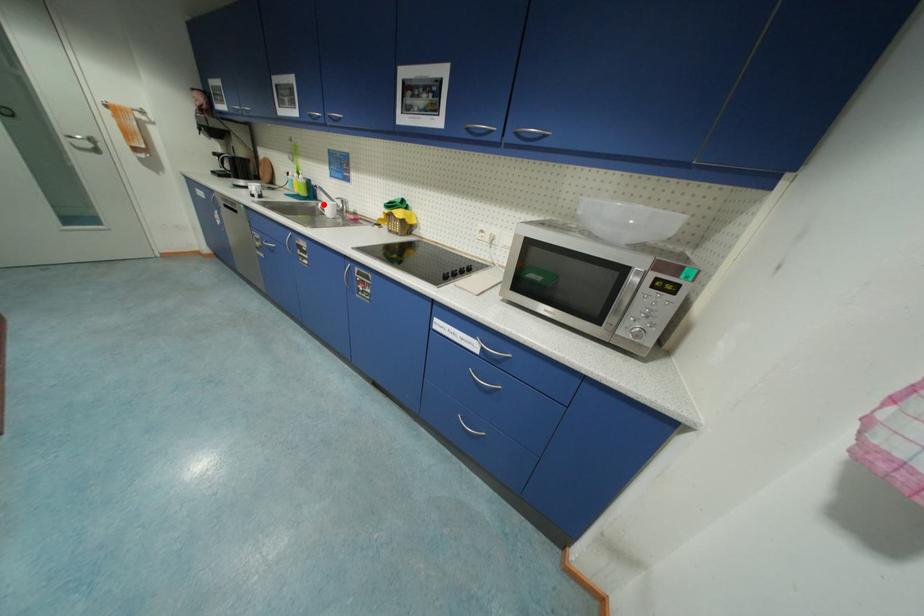
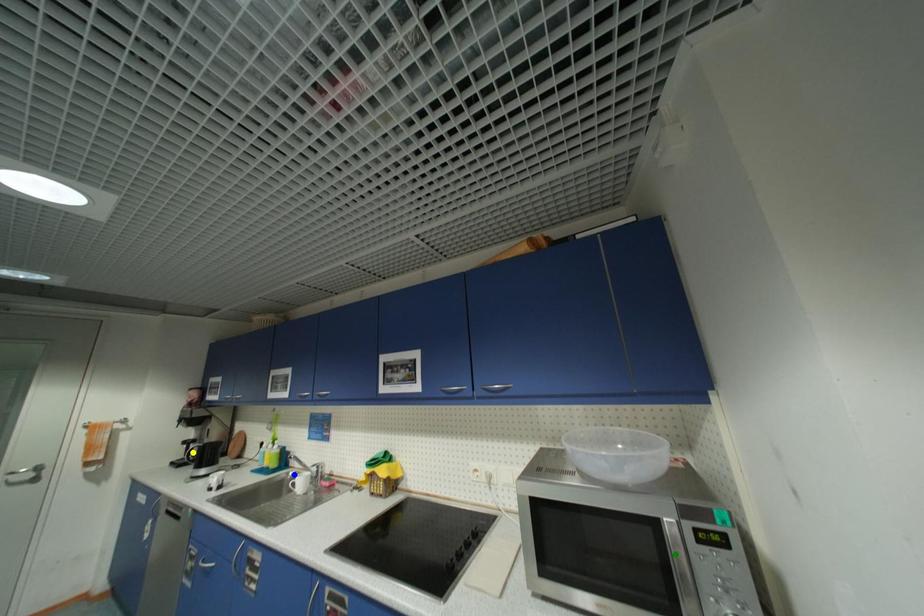
Question: I am providing you with two images of the same scene from different viewpoints. A red point is marked on the first image. You are given multiple points on the second image. Which point in image 2 is actually the same real-world point as the red point in image 1?

Choices:
 (A) blue point
 (B) green point
 (C) yellow point

Answer: (A)